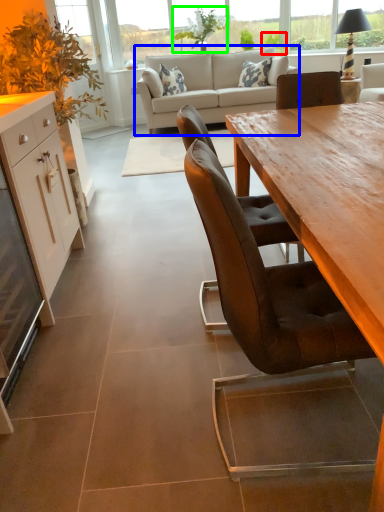
Question: Based on their relative distances, which object is nearer to plant (highlighted by a red box)? Choose from studio couch (highlighted by a blue box) and plant (highlighted by a green box).

Choices:
 (A) studio couch
 (B) plant

Answer: (B)